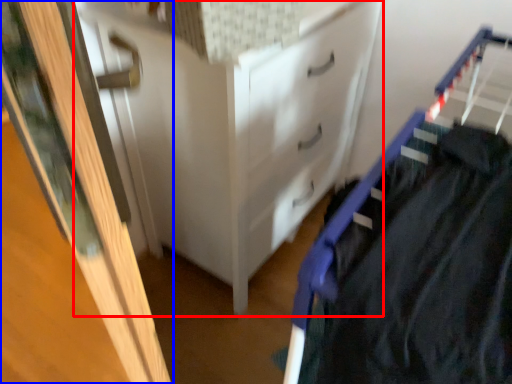
Question: Which of the following is the closest to the observer, chest of drawers (highlighted by a red box) or door (highlighted by a blue box)?

Choices:
 (A) chest of drawers
 (B) door

Answer: (B)